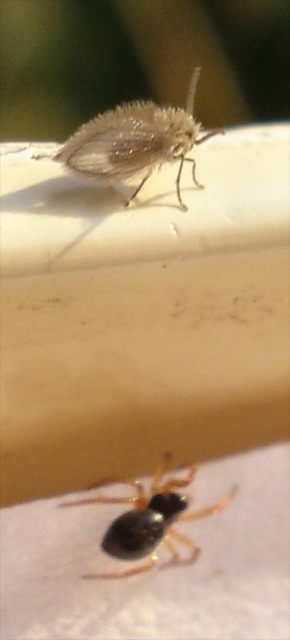
What do you see at coordinates (136, 140) in the screenshot? This screenshot has height=640, width=290. I see `translucent fuzzy fly at upper center` at bounding box center [136, 140].

Is translucent fuzzy fly at upper center thinner than black glossy spider at lower center?

Yes.

You are a GUI agent. You are given a task and a screenshot of the screen. Output one action in this format:
    pyautogui.click(x=<x>, y=<y>)
    Task: Click on the translucent fuzzy fly at upper center
    
    Given the screenshot: What is the action you would take?
    pyautogui.click(x=136, y=140)